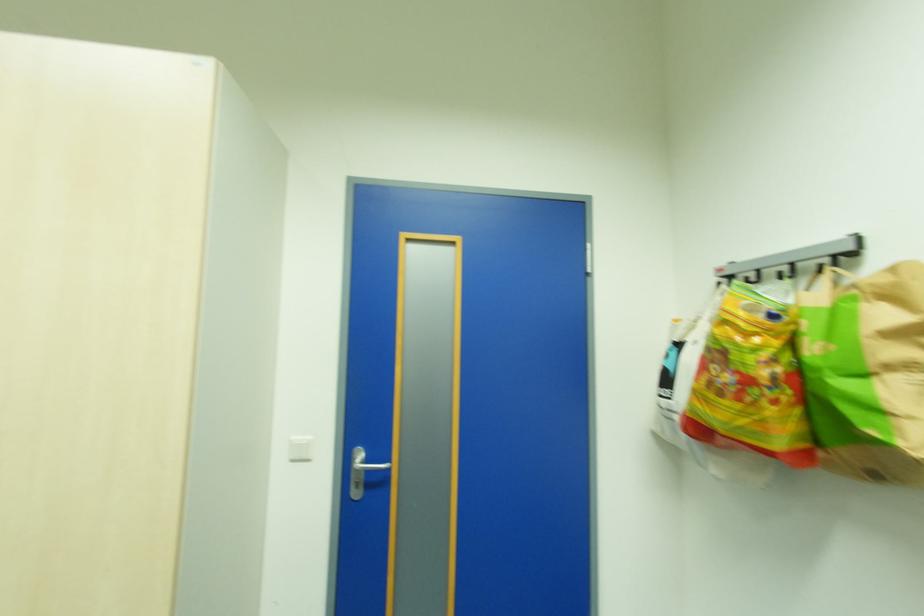
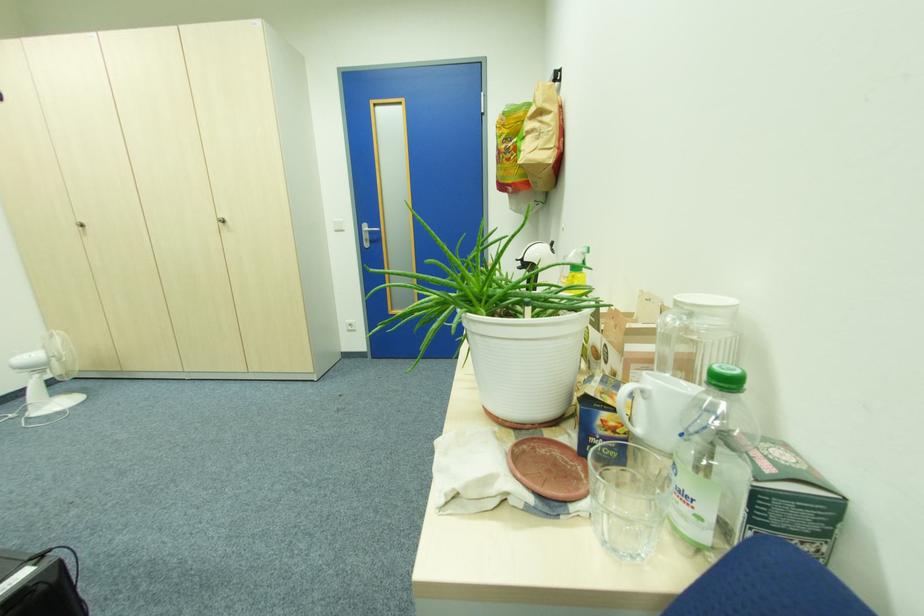
Which direction would the cameraman need to move to produce the second image?

The cameraman moved toward right, backward.